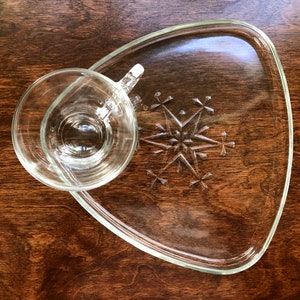
The height and width of the screenshot is (300, 300). I want to click on handle, so click(x=135, y=73).